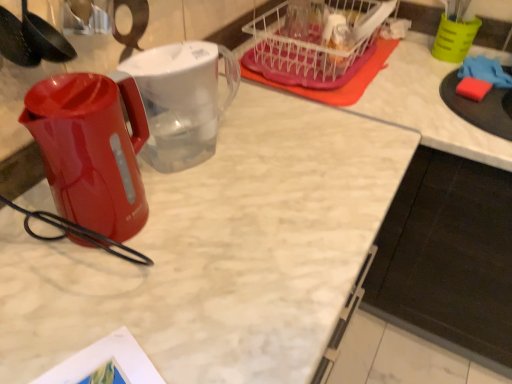
Find the location of a particular element. vacant area located to the right-hand side of glossy plastic kettle at left is located at coordinates pyautogui.click(x=206, y=224).